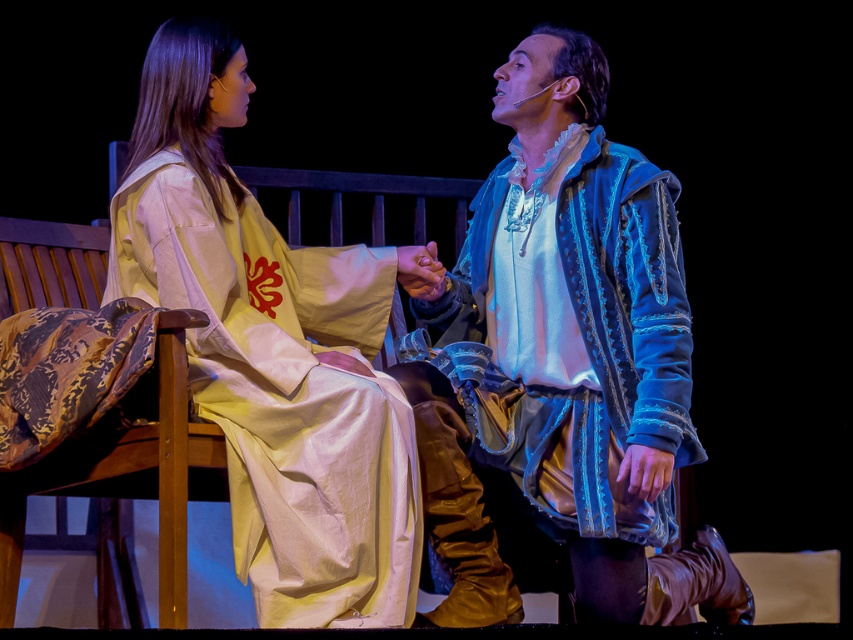
Question: Observing the image, what is the correct spatial positioning of blue suede jacket at center in reference to silk robe at left?

Choices:
 (A) right
 (B) left

Answer: (A)

Question: Which of the following is the closest to the observer?

Choices:
 (A) (325, 321)
 (B) (509, 173)

Answer: (B)

Question: Is blue suede jacket at center to the right of silk robe at left from the viewer's perspective?

Choices:
 (A) no
 (B) yes

Answer: (B)

Question: Which point is closer to the camera?

Choices:
 (A) (251, 458)
 (B) (610, 568)

Answer: (A)

Question: Does blue suede jacket at center have a smaller size compared to silk robe at left?

Choices:
 (A) no
 (B) yes

Answer: (A)